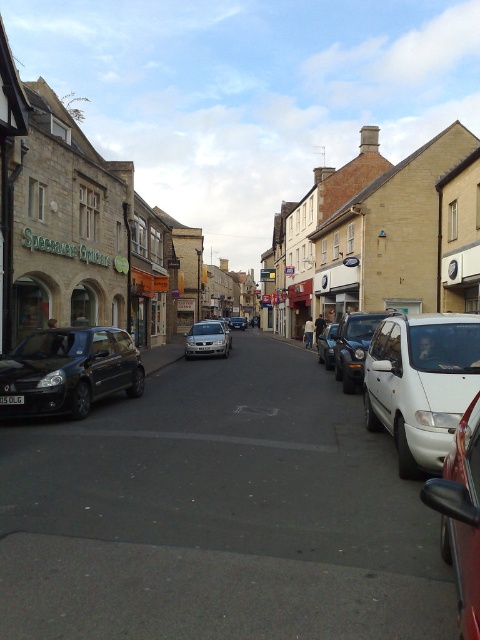
Question: Can you confirm if matte black car at left is wider than metallic silver van at center?

Choices:
 (A) no
 (B) yes

Answer: (B)

Question: Is white matte van at center thinner than silver metallic car at center?

Choices:
 (A) yes
 (B) no

Answer: (A)

Question: Does metallic red car at right have a greater width compared to metallic silver van at center?

Choices:
 (A) yes
 (B) no

Answer: (B)

Question: Considering the real-world distances, which object is closest to the metallic red car at right?

Choices:
 (A) white matte van at center
 (B) matte black car at left
 (C) white matte van at right
 (D) metallic silver van at center

Answer: (C)

Question: Which object is positioned farthest from the white matte van at right?

Choices:
 (A) matte black car at left
 (B) metallic silver van at center

Answer: (B)

Question: Which of these objects is positioned closest to the silver metallic sedan at center?

Choices:
 (A) metallic red car at right
 (B) white matte van at center
 (C) silver metallic car at center
 (D) metallic silver van at center

Answer: (C)